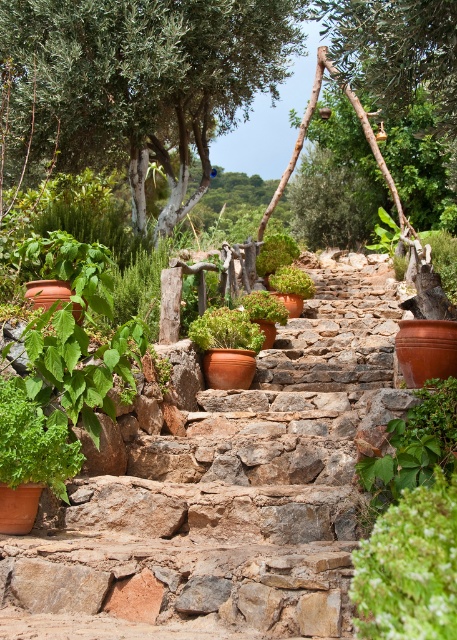
You are standing at the bottom of the rustic stone staircase in the garden. You notice two points marked in the image. One is at coordinate point (249, 556) and the other at point (102, 8). If you were to walk towards the staircase, which point would you encounter first?

The point at coordinate (249, 556) is in front of point (102, 8), so you would encounter the point (249, 556) first as you walk towards the staircase.

You are a gardener who needs to water both the terracotta stone stairs at center and the green leafy tree at upper center. Which object requires more water based on their size?

The terracotta stone stairs at center is larger in size than the green leafy tree at upper center, so it requires more water.

You are a delivery robot with a height of 1.6 meters. You need to navigate through the garden to reach the front door, which is located at the top of the terracotta stone stairs at center. The path is narrow, and there are low hanging branches above the stairs. Can you safely pass under the branches without hitting your head?

The terracotta stone stairs at center are 2.88 meters away from the camera. However, the height of the branches is not specified in the provided information, so it is impossible to determine if the robot can safely pass under them without hitting its head. More information about the branch height is needed.